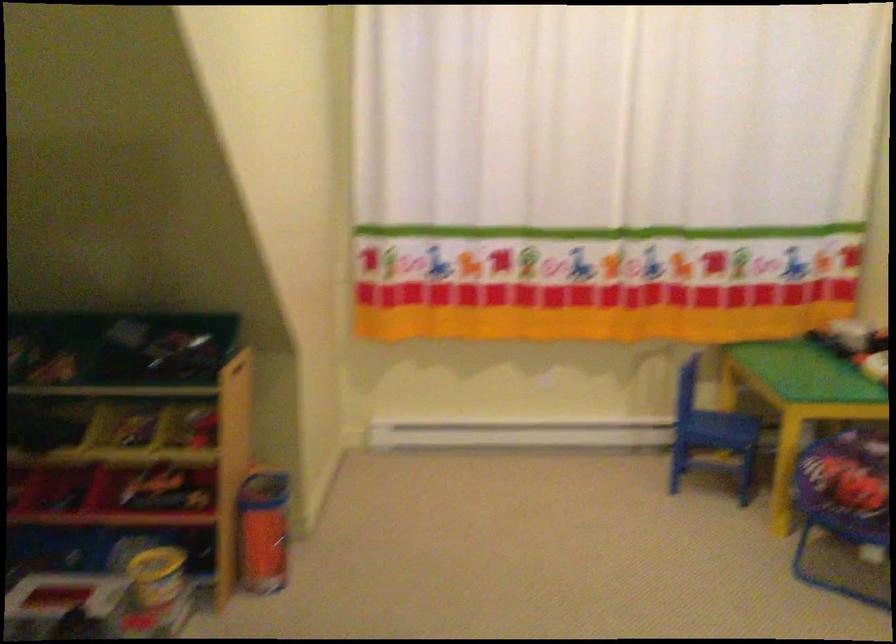
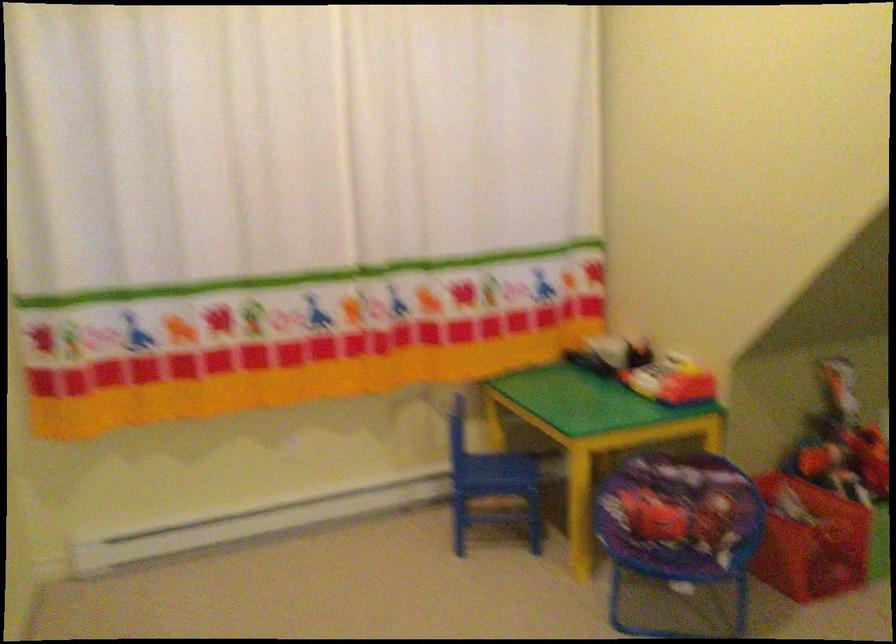
Question: The first image is from the beginning of the video and the second image is from the end. How did the camera likely rotate when shooting the video?

Choices:
 (A) Left
 (B) Right
 (C) Up
 (D) Down

Answer: (B)